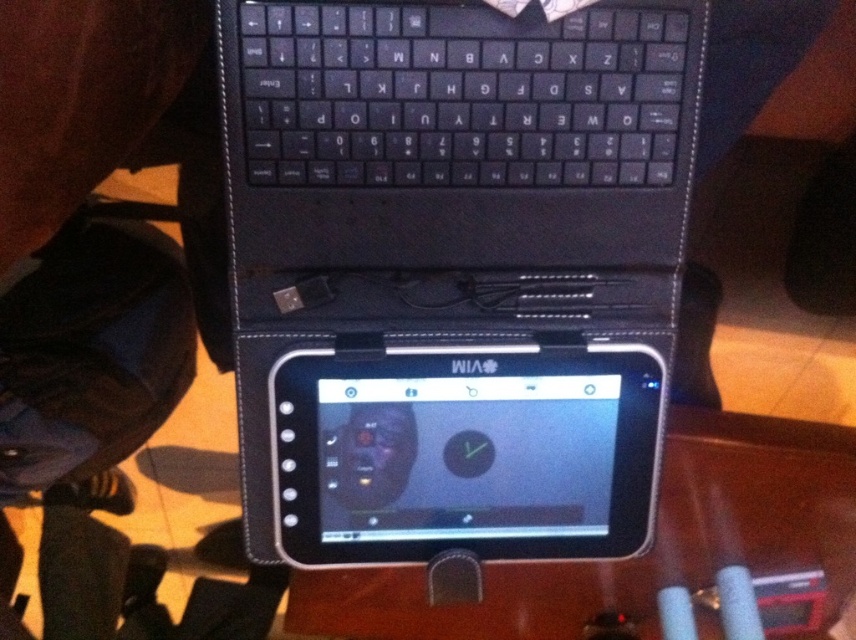
You have two tablets, a black matte tablet at center and a black glossy tablet at center, attached to a laptop. You need to place a sticker on the wider one. Which tablet should you choose?

The black matte tablet at center is wider than the black glossy tablet at center, so you should place the sticker on the black matte tablet at center.

From the picture: You are sitting at a desk and want to reach the black glossy tablet at center without moving your chair. Can you comfortably reach it if your arms can extend 90 centimeters?

The black glossy tablet at center is 89.87 centimeters away from the viewer. Since your arms can extend 90 centimeters, you can comfortably reach it.

You are setting up a hybrid device consisting of a laptop and a tablet. You need to place both the black matte tablet at center and the black plastic keyboard at upper center on a desk. Based on their sizes, which one should you place first to ensure they fit properly?

The black matte tablet at center might be wider than the black plastic keyboard at upper center, so you should place the wider tablet first to ensure proper arrangement.